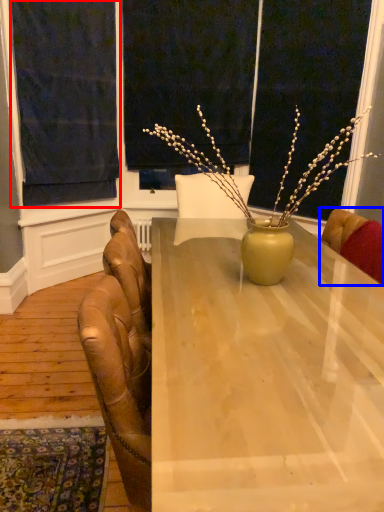
Question: Which object is closer to the camera taking this photo, curtain (highlighted by a red box) or chair (highlighted by a blue box)?

Choices:
 (A) curtain
 (B) chair

Answer: (B)